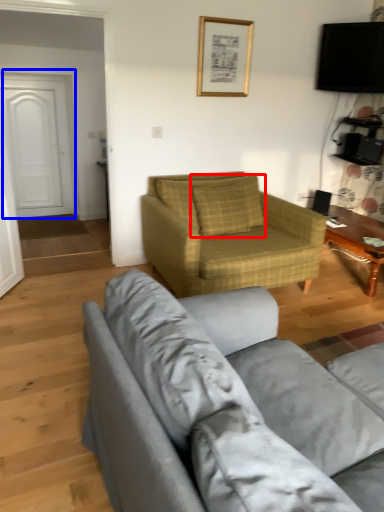
Question: Which object is further to the camera taking this photo, pillow (highlighted by a red box) or door (highlighted by a blue box)?

Choices:
 (A) pillow
 (B) door

Answer: (B)